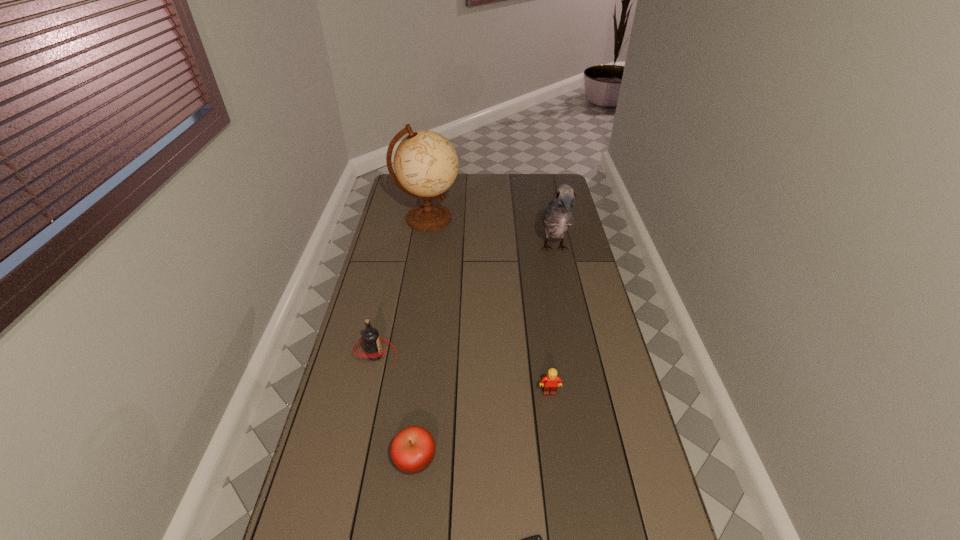
Where is `vacant space that satisfies the following two spatial constraints: 1. on the front-facing side of the rightmost object; 2. on the label of the fourth shortest object`? The height and width of the screenshot is (540, 960). vacant space that satisfies the following two spatial constraints: 1. on the front-facing side of the rightmost object; 2. on the label of the fourth shortest object is located at coordinates (576, 355).